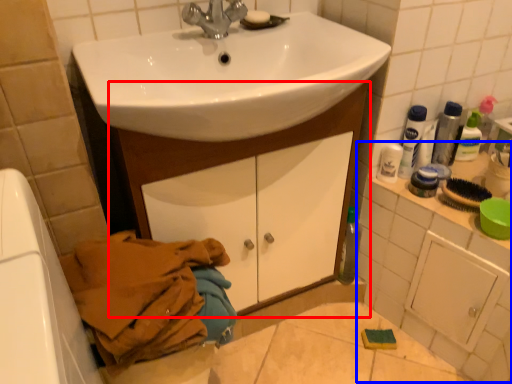
Question: Which object is further to the camera taking this photo, bathroom cabinet (highlighted by a red box) or counter top (highlighted by a blue box)?

Choices:
 (A) bathroom cabinet
 (B) counter top

Answer: (B)